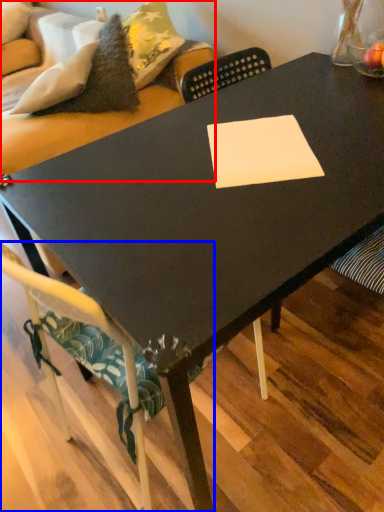
Question: Which object appears closest to the camera in this image, couch (highlighted by a red box) or chair (highlighted by a blue box)?

Choices:
 (A) couch
 (B) chair

Answer: (B)